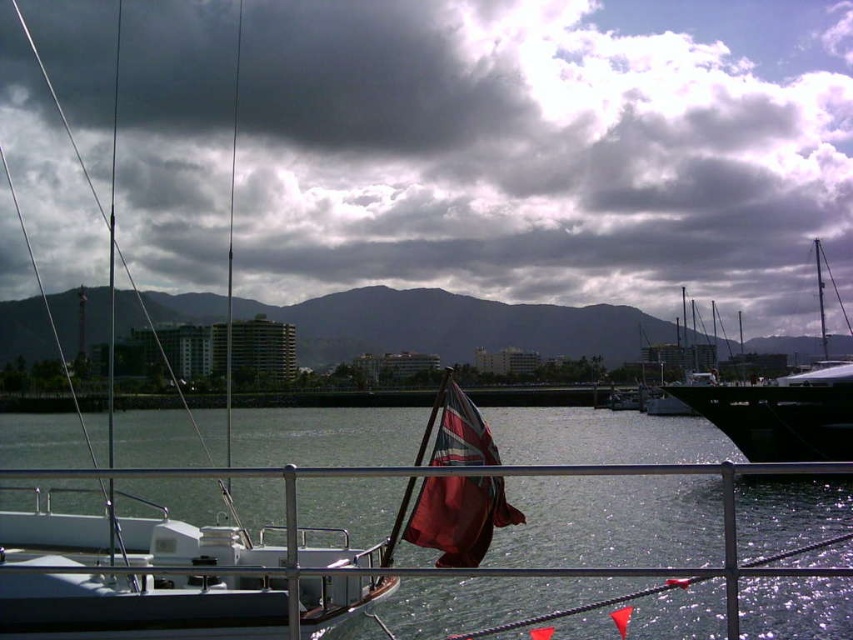
Question: Which of the following is the closest to the observer?

Choices:
 (A) (821, 369)
 (B) (701, 188)
 (C) (132, 420)

Answer: (A)

Question: Among these objects, which one is nearest to the camera?

Choices:
 (A) red fabric flag at center
 (B) black glossy sailboat at right

Answer: (B)

Question: Does clear water at center appear on the right side of shiny metallic mast at upper right?

Choices:
 (A) no
 (B) yes

Answer: (A)

Question: Which point appears farthest from the camera in this image?

Choices:
 (A) (x=306, y=586)
 (B) (x=511, y=518)

Answer: (B)

Question: Can you confirm if white matte boat at left is thinner than red fabric flag at center?

Choices:
 (A) yes
 (B) no

Answer: (B)

Question: Is cloudy sky at upper center wider than dark brown mountain at center?

Choices:
 (A) yes
 (B) no

Answer: (A)